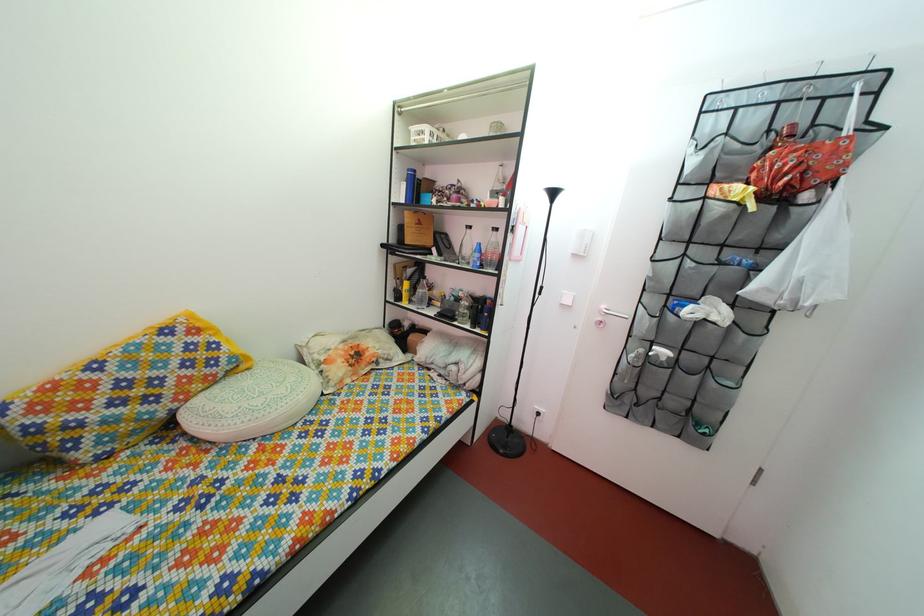
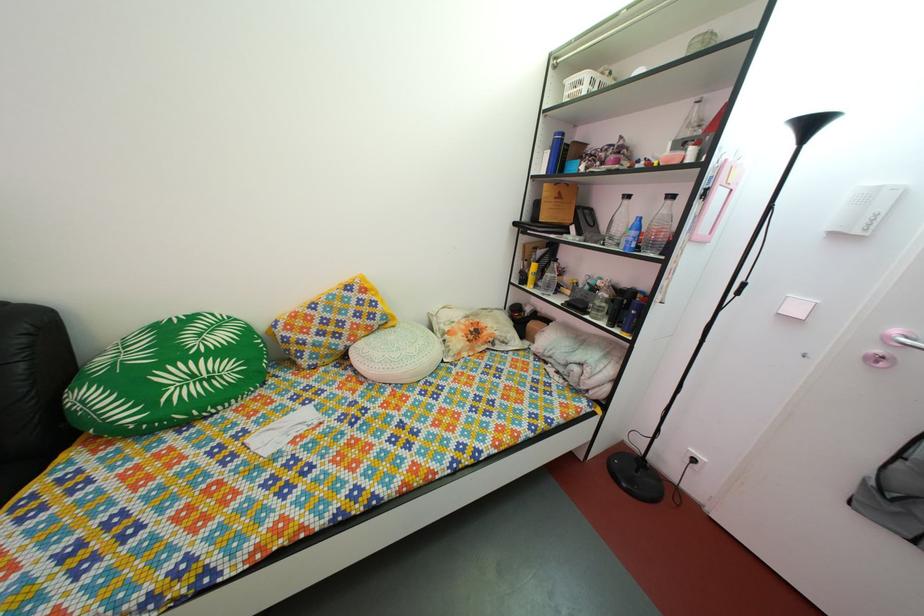
Locate, in the second image, the point that corresponds to [171,424] in the first image.

(349, 357)